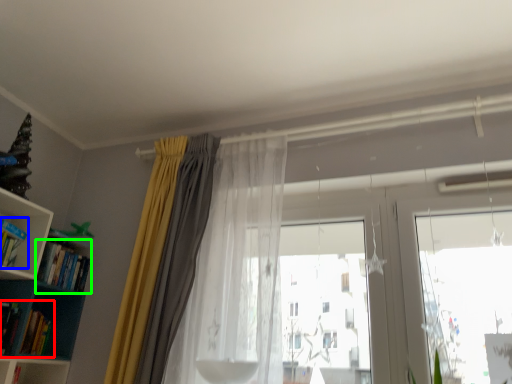
Question: Estimate the real-world distances between objects in this image. Which object is closer to book (highlighted by a red box), book (highlighted by a blue box) or book (highlighted by a green box)?

Choices:
 (A) book
 (B) book

Answer: (B)